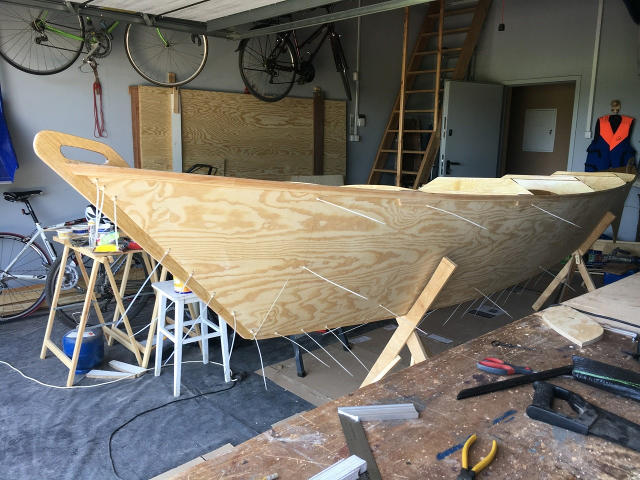
Locate an element on the screen. bicycles hanging from seiling is located at coordinates (66, 51), (285, 66).